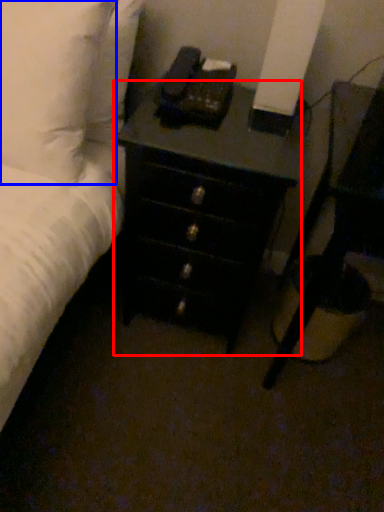
Question: Which object appears farthest to the camera in this image, chest of drawers (highlighted by a red box) or pillow (highlighted by a blue box)?

Choices:
 (A) chest of drawers
 (B) pillow

Answer: (A)